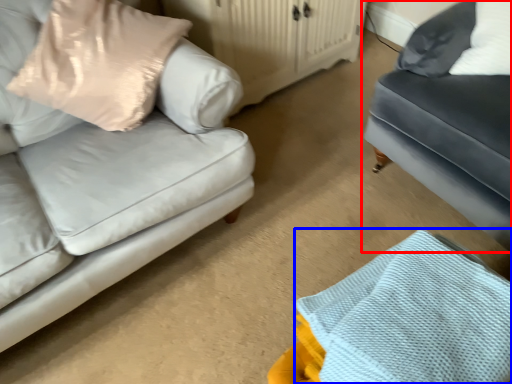
Question: Which of the following is the farthest to the observer, studio couch (highlighted by a red box) or material (highlighted by a blue box)?

Choices:
 (A) studio couch
 (B) material

Answer: (A)